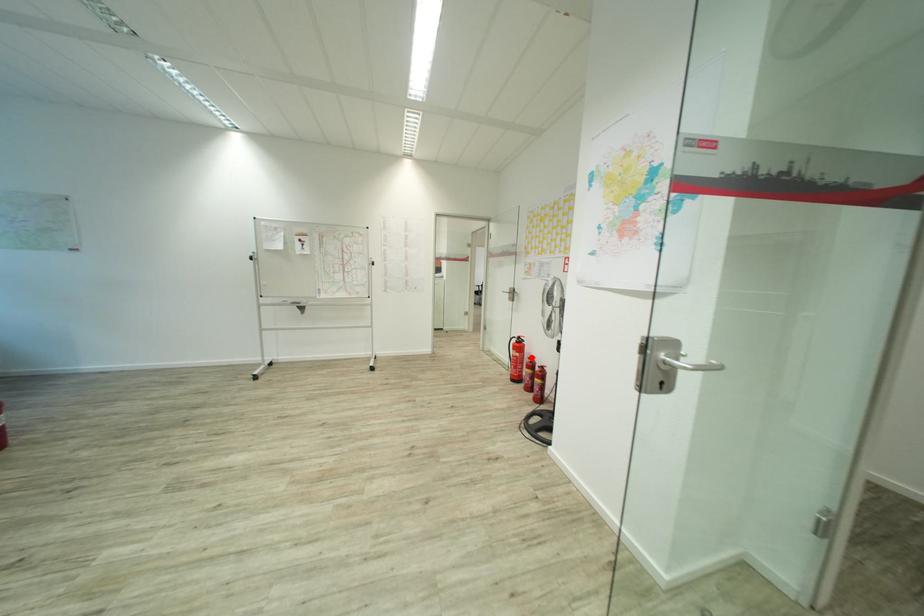
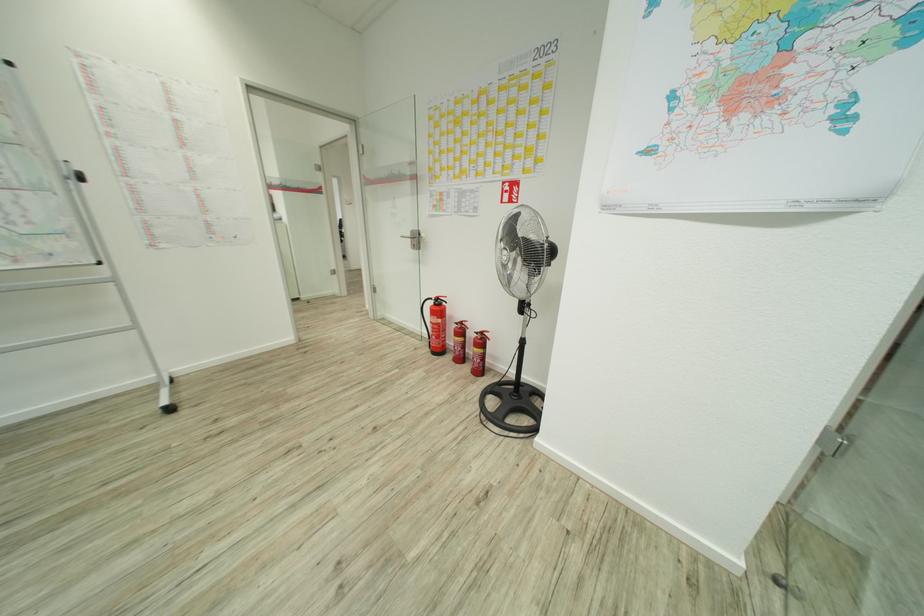
Find the pixel in the second image that matches the highlighted location in the first image.

(459, 322)